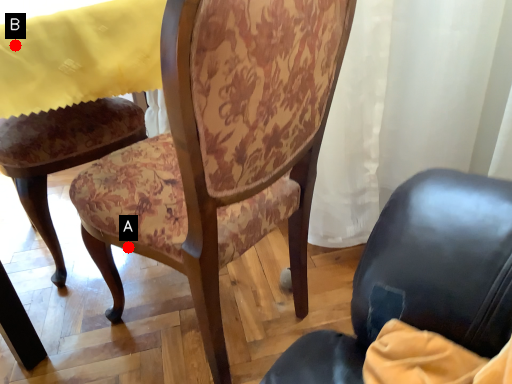
Question: Two points are circled on the image, labeled by A and B beside each circle. Which point is farther from the camera taking this photo?

Choices:
 (A) A is further
 (B) B is further

Answer: (A)